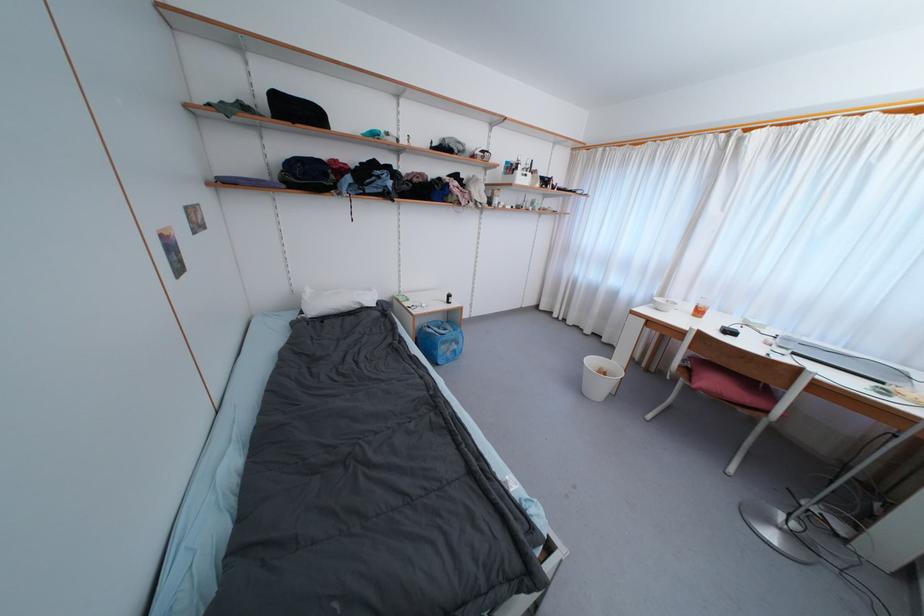
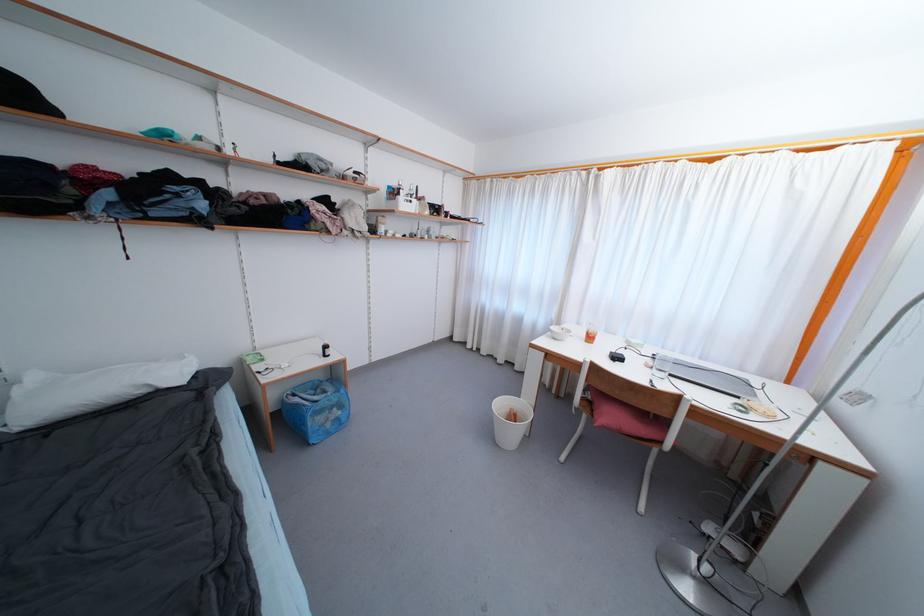
In a continuous first-person perspective shot, in which direction is the camera moving?

The cameraman walked toward right, forward.